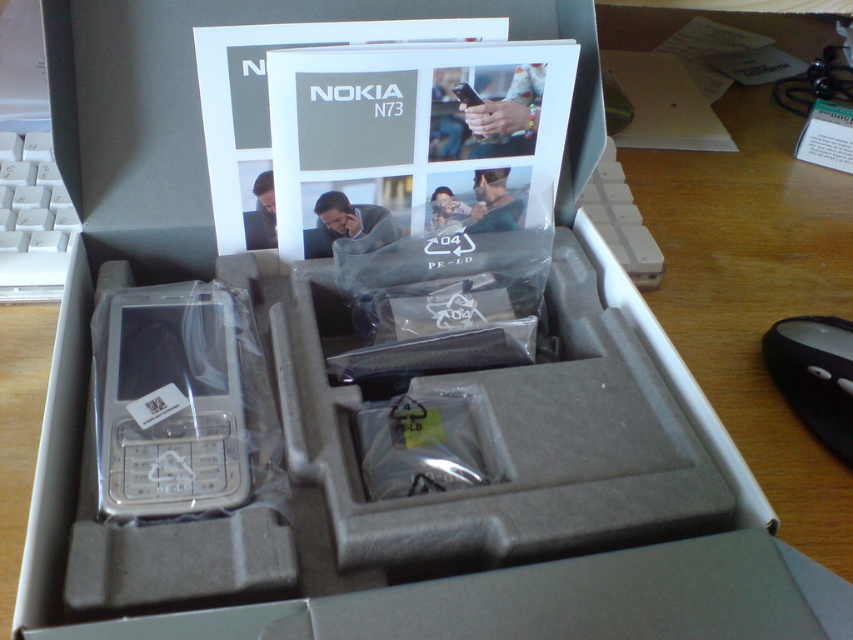
Question: Which point appears farthest from the camera in this image?

Choices:
 (A) click(851, 406)
 (B) click(48, 193)

Answer: (B)

Question: Is silver metallic phone at center below black plastic mouse at lower right?

Choices:
 (A) no
 (B) yes

Answer: (A)

Question: Considering the real-world distances, which object is closest to the black plastic mouse at lower right?

Choices:
 (A) white plastic keyboard at upper left
 (B) silver metallic phone at center

Answer: (B)

Question: Which point is farther to the camera?

Choices:
 (A) white plastic keyboard at upper left
 (B) silver metallic phone at center
 (C) black plastic mouse at lower right

Answer: (A)

Question: Does silver metallic phone at center have a greater width compared to white plastic keyboard at upper left?

Choices:
 (A) yes
 (B) no

Answer: (A)

Question: Is silver metallic phone at center above white plastic keyboard at upper left?

Choices:
 (A) yes
 (B) no

Answer: (B)